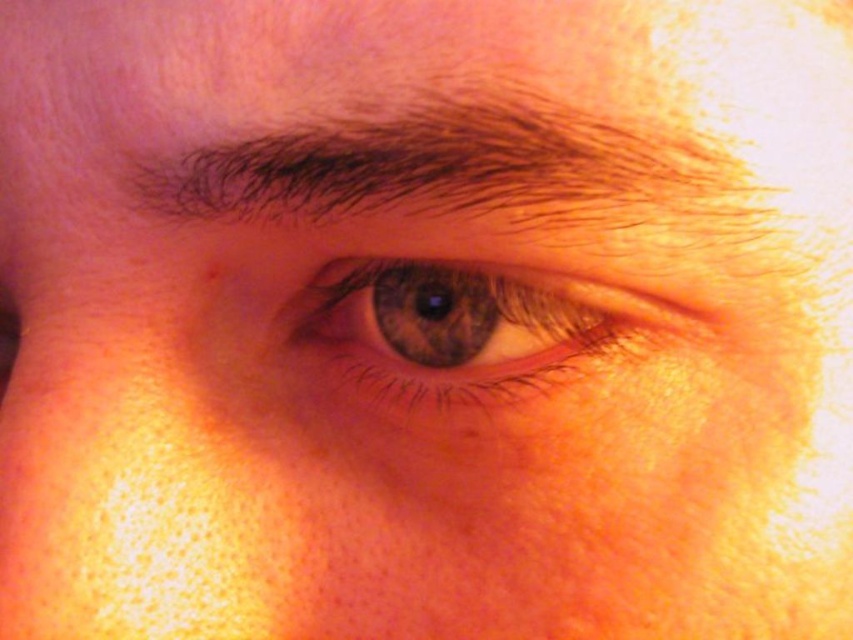
You are a photographer adjusting your camera settings to focus on two points in the image of an eye. The points are labeled as point [264,195] and point [201,289]. Based on the scene description, which point should you focus on first to ensure the closest object is sharp?

Point [264,195] should be focused on first because it is closer to the camera than point [201,289] according to the description.

Based on the scene description, which object is wider between the dark brown hair at upper center and the brown matte freckle at upper left?

The dark brown hair at upper center is wider than the brown matte freckle at upper left according to the description.